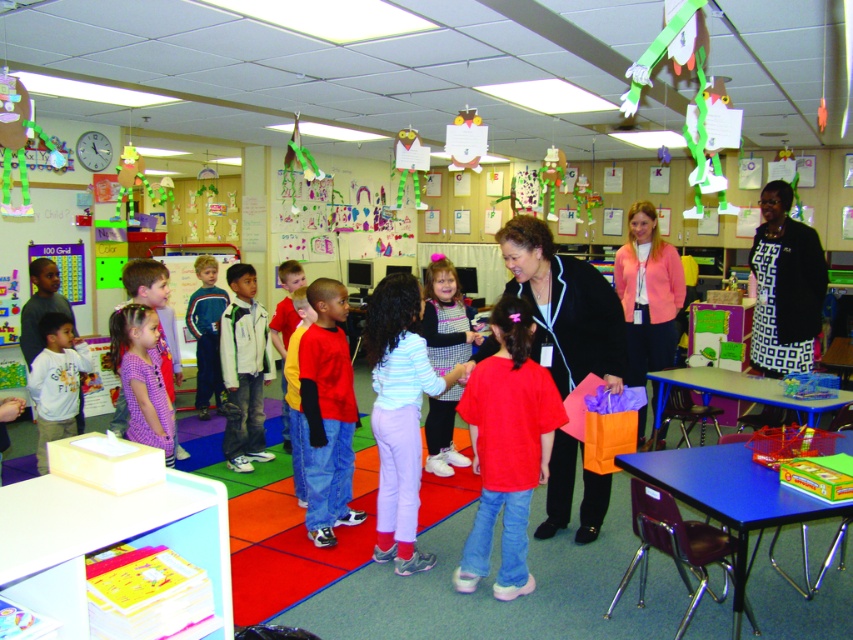
From the picture: You are a photographer trying to capture a group photo of the children and adults in the classroom. You notice the green and white jacket at center and the matte gray shirt at left. Which clothing item should you focus on first if you want to include both in the frame without zooming in or out?

The green and white jacket at center is smaller in size compared to the matte gray shirt at left. To include both in the frame without zooming, focus on the matte gray shirt at left first since it is larger and will be easier to frame, then adjust to ensure the smaller green and white jacket at center is also visible.

You are a photographer standing at the back of the classroom. You want to take a photo that includes both the striped cotton shirt at center and the green and white jacket at center. Can you fit both in the frame if your camera has a maximum horizontal field of view of 5 feet?

The striped cotton shirt at center and green and white jacket at center are 5.31 feet apart from each other. Since the distance between them exceeds the camera field of view by 0.31 feet, you cannot fit both in the frame.

You are a photographer trying to capture a group photo of the black matte jacket at center and the purple checkered dress at center. To ensure both are in frame, should you position the camera to the left or right of the group?

You should position the camera to the left of the group because the black matte jacket at center is on the right side of the purple checkered dress at center, so placing the camera to the left will ensure both are visible in the frame.